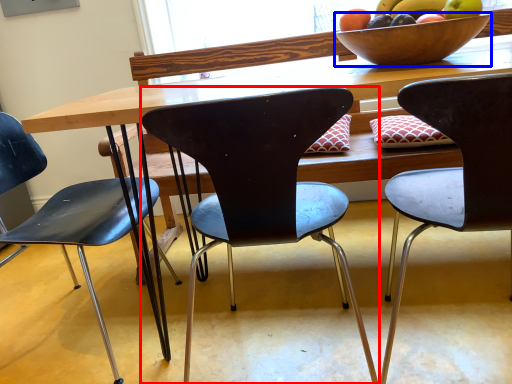
Question: Among these objects, which one is farthest to the camera, chair (highlighted by a red box) or bowl (highlighted by a blue box)?

Choices:
 (A) chair
 (B) bowl

Answer: (B)